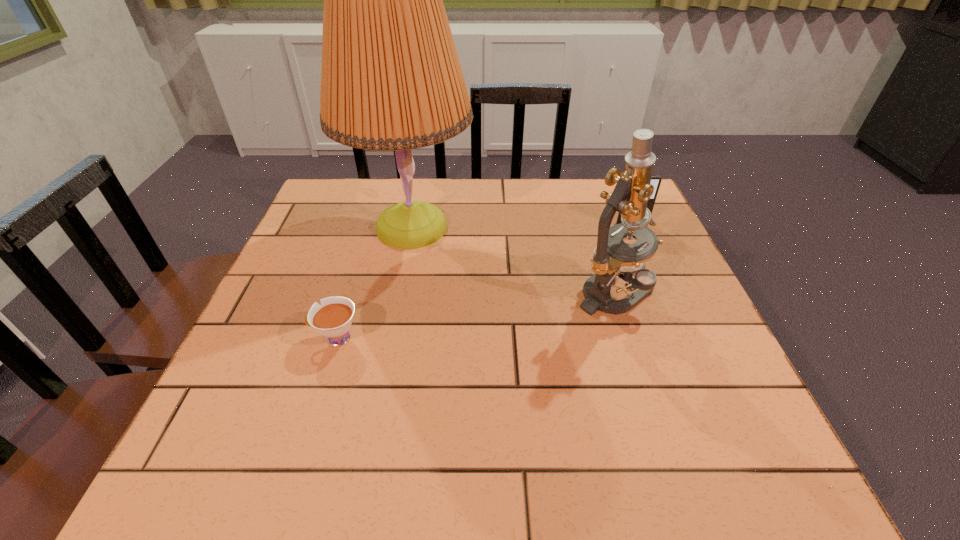
Locate an element on the screen. Image resolution: width=960 pixels, height=540 pixels. free region at the near edge of the desktop is located at coordinates (332, 442).

In the image, there is a desktop. Find the location of `vacant space at the left edge`. vacant space at the left edge is located at coordinates (307, 286).

At what (x,y) coordinates should I click in order to perform the action: click on vacant space at the right edge of the desktop. Please return your answer as a coordinate pair (x, y). Looking at the image, I should click on (645, 375).

Where is `free point at the far left corner`? The height and width of the screenshot is (540, 960). free point at the far left corner is located at coordinates (324, 219).

Where is `blank space at the near left corner`? blank space at the near left corner is located at coordinates point(176,487).

At what (x,y) coordinates should I click in order to perform the action: click on vacant space that is in between the iPod and the lamp. Please return your answer as a coordinate pair (x, y). The width and height of the screenshot is (960, 540). Looking at the image, I should click on (521, 226).

Identify the location of free spot between the shortest object and the lamp. (373, 283).

Find the location of a particular element. Image resolution: width=960 pixels, height=540 pixels. empty space that is in between the third tallest object and the tallest object is located at coordinates (521, 226).

Identify the location of vacant space that's between the lamp and the nearest object. The image size is (960, 540). (373, 283).

I want to click on vacant region between the microscope and the tallest object, so click(513, 260).